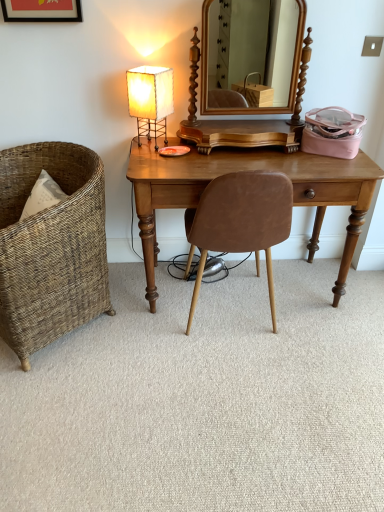
You are a GUI agent. You are given a task and a screenshot of the screen. Output one action in this format:
    pyautogui.click(x=<x>, y=<y>)
    Task: Click on the free space on the front side of light brown wood desk at center
    
    Given the screenshot: What is the action you would take?
    pyautogui.click(x=244, y=395)